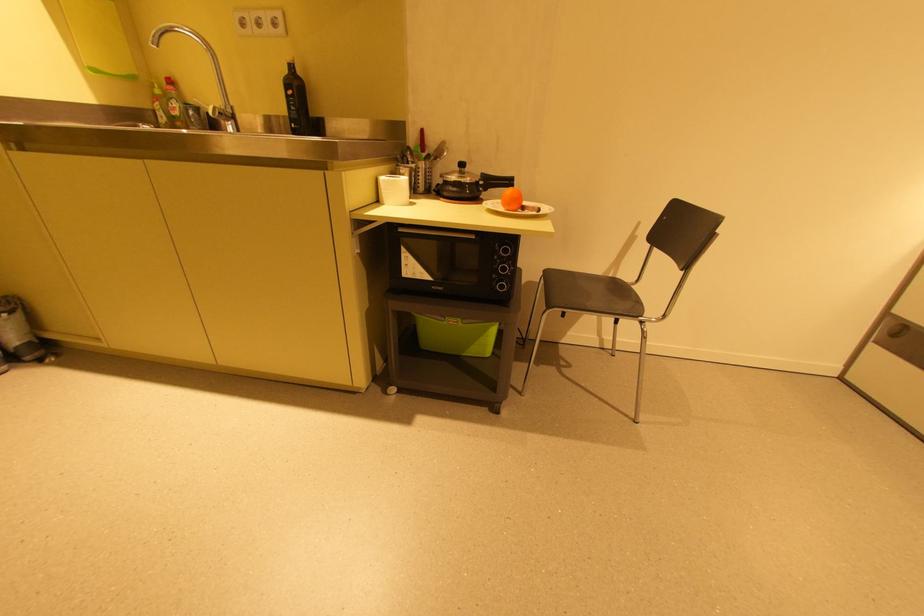
The width and height of the screenshot is (924, 616). Find the location of `dark glass bottle`. dark glass bottle is located at coordinates (296, 100).